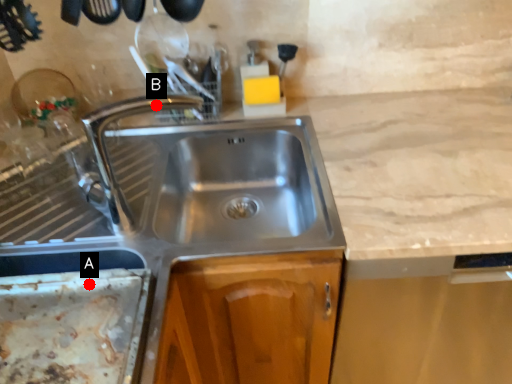
Question: Two points are circled on the image, labeled by A and B beside each circle. Among these points, which one is farthest from the camera?

Choices:
 (A) A is further
 (B) B is further

Answer: (B)